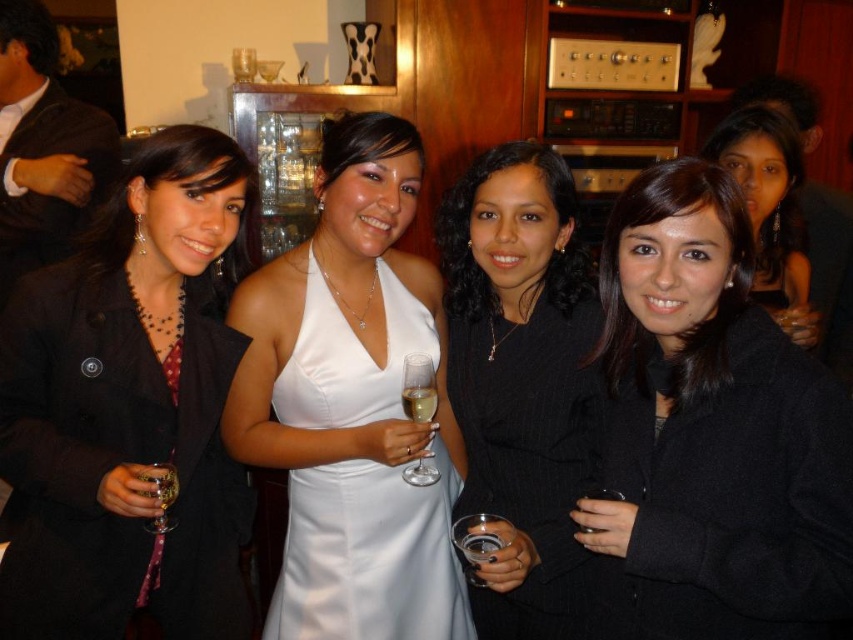
You are organizing a photo shoot and need to arrange the black wool coat at center and the black wool coat at lower right on a rack. Based on the image, which coat should you place first on the rack if you want to maximize space efficiency?

The black wool coat at lower right is narrower, so place it first to save space for the wider black wool coat at center.

You are at a party and want to grab a drink without moving from your current spot. You see the black wool coat at center and the clear glass wine glass at lower right. Which object is closer to your hand if you reach straight out?

The clear glass wine glass at lower right is closer because it is below the black wool coat at center, meaning it is positioned lower and likely within reach without moving.